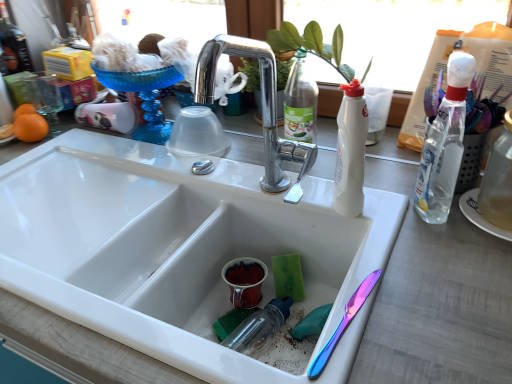
You are a GUI agent. You are given a task and a screenshot of the screen. Output one action in this format:
    pyautogui.click(x=<x>, y=<y>)
    Task: Click on the free point in front of clear plastic bottle at right, the second bottle when ordered from right to left
    
    Given the screenshot: What is the action you would take?
    pyautogui.click(x=438, y=269)